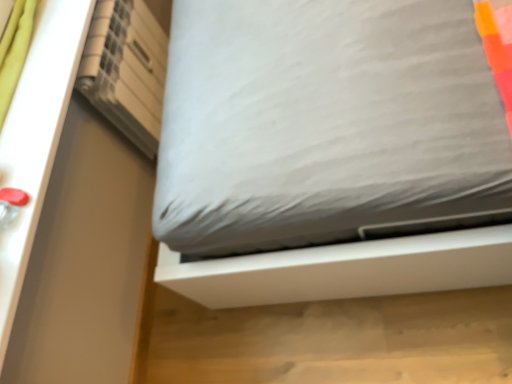
Question: Based on their sizes in the image, would you say white matte shelf at upper left is bigger or smaller than white fabric bed at center?

Choices:
 (A) big
 (B) small

Answer: (A)

Question: From a real-world perspective, is white matte shelf at upper left above or below white fabric bed at center?

Choices:
 (A) above
 (B) below

Answer: (A)

Question: Considering the positions of white matte shelf at upper left and white fabric bed at center in the image, is white matte shelf at upper left taller or shorter than white fabric bed at center?

Choices:
 (A) tall
 (B) short

Answer: (A)

Question: Is white fabric bed at center wider or thinner than white matte shelf at upper left?

Choices:
 (A) thin
 (B) wide

Answer: (B)

Question: From the image's perspective, is white fabric bed at center located above or below white matte shelf at upper left?

Choices:
 (A) above
 (B) below

Answer: (B)

Question: Is white fabric bed at center bigger or smaller than white matte shelf at upper left?

Choices:
 (A) big
 (B) small

Answer: (B)

Question: Based on their positions, is white fabric bed at center located to the left or right of white matte shelf at upper left?

Choices:
 (A) right
 (B) left

Answer: (A)